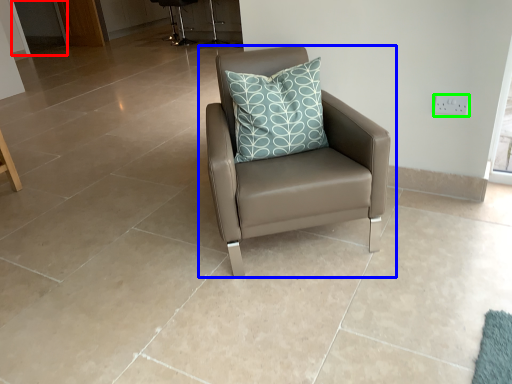
Question: Estimate the real-world distances between objects in this image. Which object is farther from screen door (highlighted by a red box), chair (highlighted by a blue box) or electric outlet (highlighted by a green box)?

Choices:
 (A) chair
 (B) electric outlet

Answer: (B)